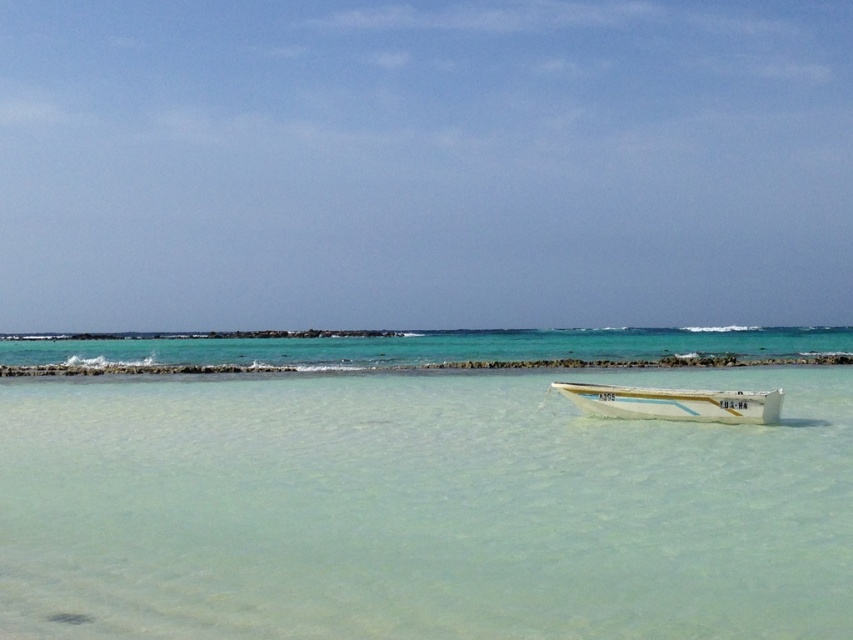
Question: Which point is closer to the camera?

Choices:
 (A) white glossy boat at center
 (B) clear water at boat right

Answer: (B)

Question: Which of the following is the farthest from the observer?

Choices:
 (A) (596, 397)
 (B) (386, 429)

Answer: (A)

Question: Is clear water at boat right thinner than white glossy boat at center?

Choices:
 (A) no
 (B) yes

Answer: (A)

Question: Is clear water at boat right smaller than white glossy boat at center?

Choices:
 (A) no
 (B) yes

Answer: (A)

Question: Which point is farther to the camera?

Choices:
 (A) clear water at boat right
 (B) white glossy boat at center

Answer: (B)

Question: Can you confirm if clear water at boat right is positioned above white glossy boat at center?

Choices:
 (A) yes
 (B) no

Answer: (B)